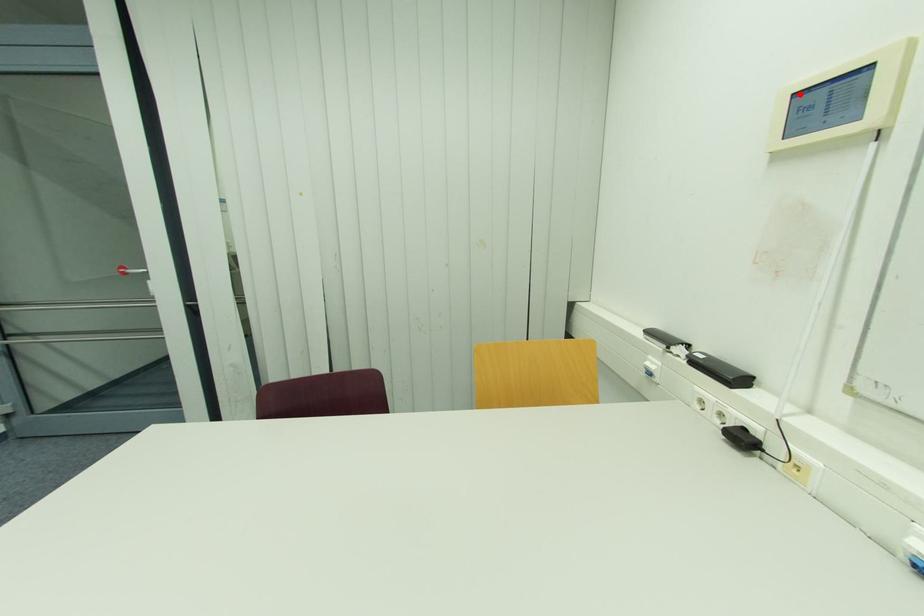
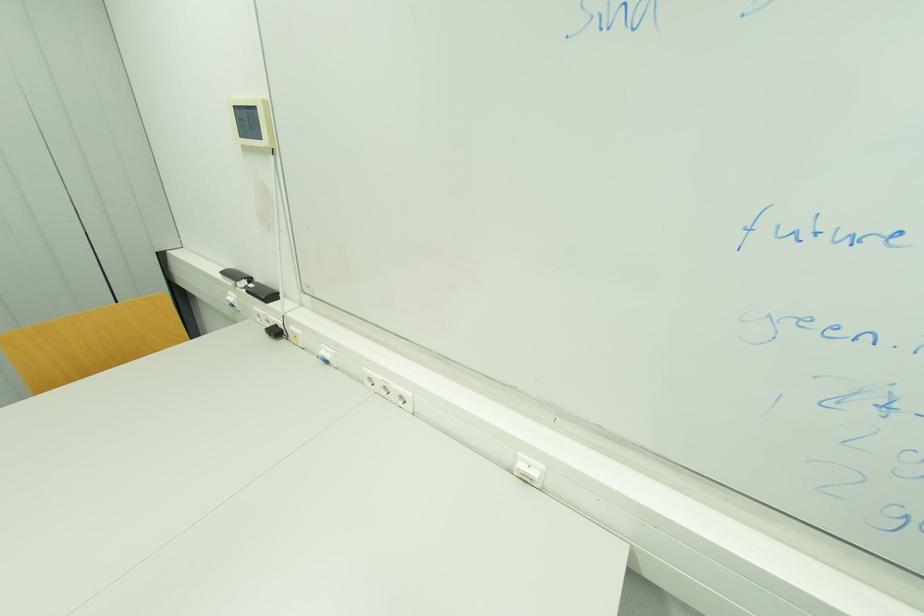
Locate, in the second image, the point that corresponds to the highlighted location in the first image.

(237, 108)